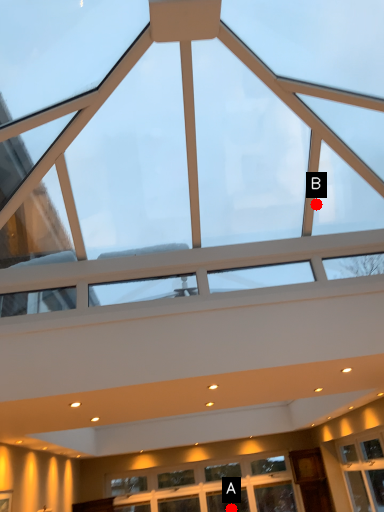
Question: Two points are circled on the image, labeled by A and B beside each circle. Which point is farther to the camera?

Choices:
 (A) A is further
 (B) B is further

Answer: (A)